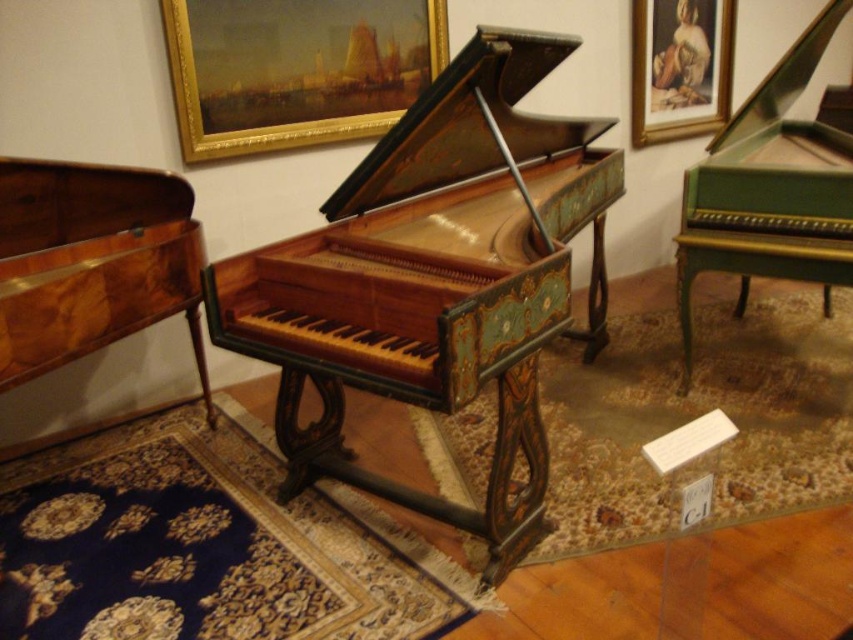
Question: Which object appears closest to the camera in this image?

Choices:
 (A) gold-framed painting at upper center
 (B) green polished wood harpsichord at right
 (C) matte gold picture frame at upper right

Answer: (B)

Question: Which object is closer to the camera taking this photo?

Choices:
 (A) matte gold picture frame at upper right
 (B) green polished wood harpsichord at right

Answer: (B)

Question: Is wooden piano at center bigger than gold-framed painting at upper center?

Choices:
 (A) no
 (B) yes

Answer: (B)

Question: Among these points, which one is nearest to the camera?

Choices:
 (A) (688, 10)
 (B) (393, 268)

Answer: (B)

Question: From the image, what is the correct spatial relationship of green polished wood harpsichord at right in relation to matte gold picture frame at upper right?

Choices:
 (A) above
 (B) below

Answer: (B)

Question: Is wooden piano at center below matte gold picture frame at upper right?

Choices:
 (A) yes
 (B) no

Answer: (A)